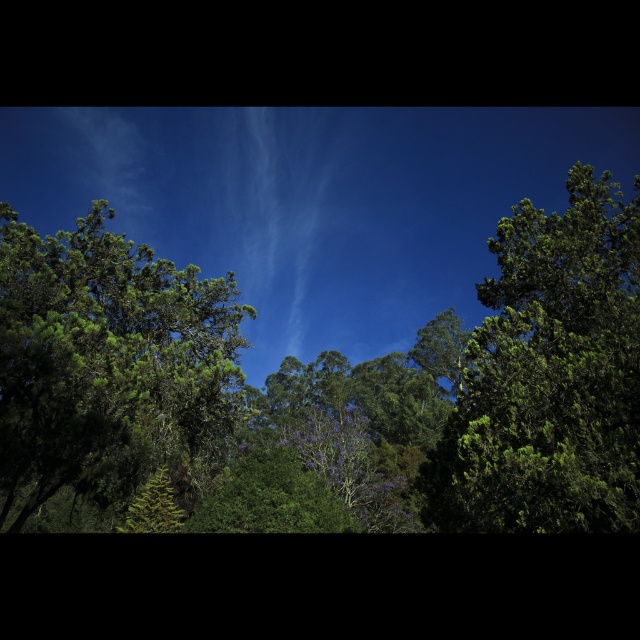
Question: Among these objects, which one is nearest to the camera?

Choices:
 (A) green leafy tree at left
 (B) green leafy tree at center

Answer: (A)

Question: In this image, where is green leafy tree at right located relative to green leafy tree at center?

Choices:
 (A) right
 (B) left

Answer: (B)

Question: Can you confirm if green leafy tree at left is smaller than green leafy tree at right?

Choices:
 (A) no
 (B) yes

Answer: (A)

Question: Considering the relative positions of green leafy tree at left and green leafy tree at right in the image provided, where is green leafy tree at left located with respect to green leafy tree at right?

Choices:
 (A) right
 (B) left

Answer: (B)

Question: Among these objects, which one is farthest from the camera?

Choices:
 (A) green leafy tree at center
 (B) green leafy tree at left
 (C) green leafy tree at right
 (D) green leafy forest at center

Answer: (A)

Question: Which point appears farthest from the camera in this image?

Choices:
 (A) (472, 416)
 (B) (172, 326)

Answer: (B)